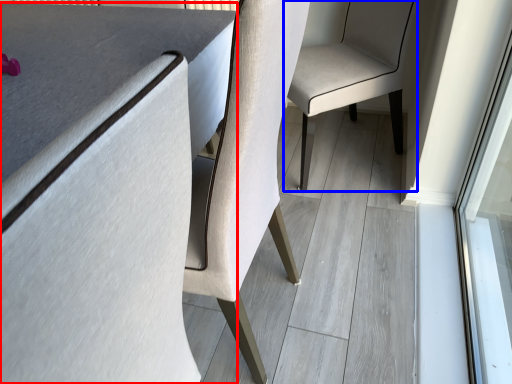
Question: Which of the following is the closest to the observer, table (highlighted by a red box) or chair (highlighted by a blue box)?

Choices:
 (A) table
 (B) chair

Answer: (A)